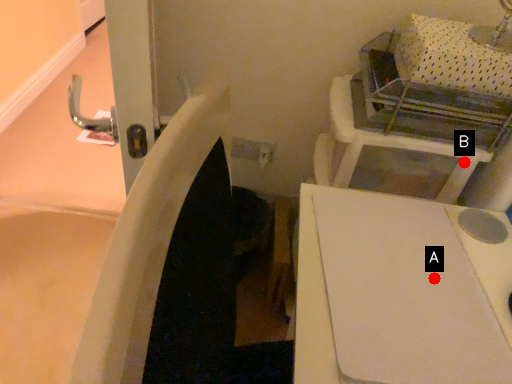
Question: Two points are circled on the image, labeled by A and B beside each circle. Which point appears farthest from the camera in this image?

Choices:
 (A) A is further
 (B) B is further

Answer: (B)